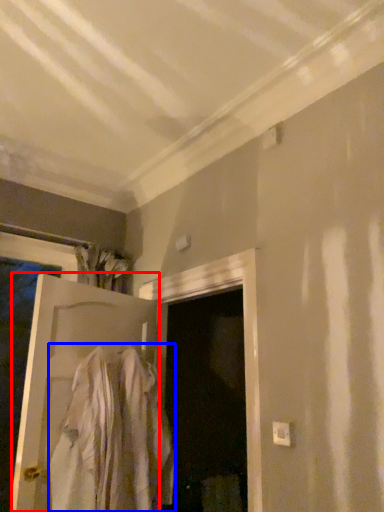
Question: Among these objects, which one is nearest to the camera, door (highlighted by a red box) or clothing (highlighted by a blue box)?

Choices:
 (A) door
 (B) clothing

Answer: (B)